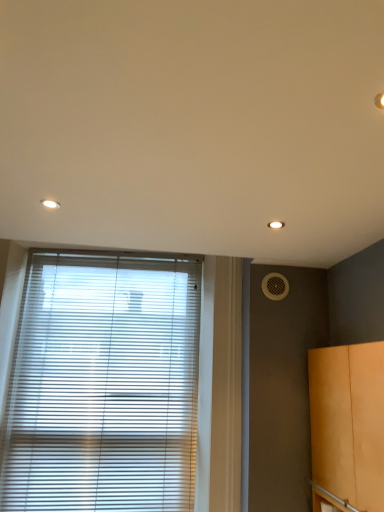
Question: From the image's perspective, is white mesh air conditioning at right on white plastic blinds at lower left?

Choices:
 (A) yes
 (B) no

Answer: (A)

Question: Are white mesh air conditioning at right and white plastic blinds at lower left located far from each other?

Choices:
 (A) no
 (B) yes

Answer: (A)

Question: Is white mesh air conditioning at right looking in the opposite direction of white plastic blinds at lower left?

Choices:
 (A) yes
 (B) no

Answer: (B)

Question: Is white mesh air conditioning at right completely or partially outside of white plastic blinds at lower left?

Choices:
 (A) no
 (B) yes

Answer: (B)

Question: Is white plastic blinds at lower left located within white mesh air conditioning at right?

Choices:
 (A) no
 (B) yes

Answer: (A)

Question: Do you think white plastic blinds at lower left is within matte orange cabinet at right, or outside of it?

Choices:
 (A) outside
 (B) inside

Answer: (A)

Question: From the image's perspective, is white plastic blinds at lower left located above or below matte orange cabinet at right?

Choices:
 (A) above
 (B) below

Answer: (A)

Question: Looking at their shapes, would you say white plastic blinds at lower left is wider or thinner than matte orange cabinet at right?

Choices:
 (A) wide
 (B) thin

Answer: (B)

Question: Based on their sizes in the image, would you say white plastic blinds at lower left is bigger or smaller than matte orange cabinet at right?

Choices:
 (A) big
 (B) small

Answer: (B)

Question: Is white mesh air conditioning at right inside the boundaries of matte orange cabinet at right, or outside?

Choices:
 (A) inside
 (B) outside

Answer: (B)

Question: Based on their sizes in the image, would you say white mesh air conditioning at right is bigger or smaller than matte orange cabinet at right?

Choices:
 (A) big
 (B) small

Answer: (B)

Question: Considering the positions of point (264, 281) and point (367, 475), is point (264, 281) closer or farther from the camera than point (367, 475)?

Choices:
 (A) farther
 (B) closer

Answer: (A)

Question: Considering the positions of white mesh air conditioning at right and matte orange cabinet at right in the image, is white mesh air conditioning at right wider or thinner than matte orange cabinet at right?

Choices:
 (A) wide
 (B) thin

Answer: (B)

Question: In the image, is white plastic blinds at lower left on the left side or the right side of white mesh air conditioning at right?

Choices:
 (A) right
 (B) left

Answer: (B)

Question: Considering the positions of white plastic blinds at lower left and white mesh air conditioning at right in the image, is white plastic blinds at lower left bigger or smaller than white mesh air conditioning at right?

Choices:
 (A) big
 (B) small

Answer: (A)